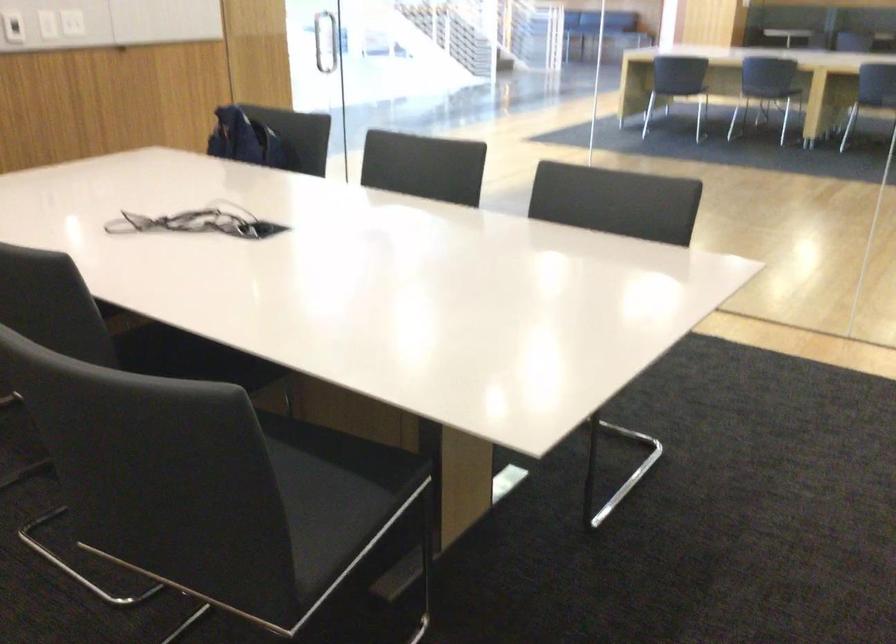
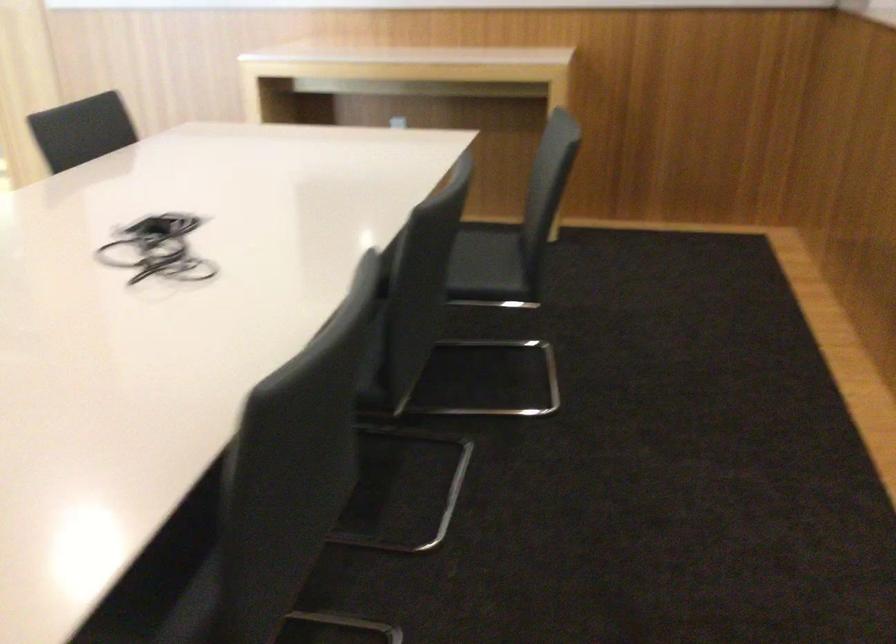
Where in the second image is the point corresponding to point 221,230 from the first image?

(158, 249)